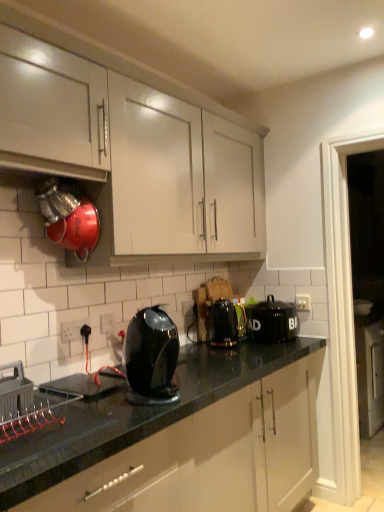
How much space does white plastic electric outlet at lower left, which ranks as the third electric outlet in right-to-left order, occupy vertically?

white plastic electric outlet at lower left, which ranks as the third electric outlet in right-to-left order, is 3.34 inches in height.

Find the location of a particular element. white matte cabinet at upper left is located at coordinates (133, 156).

How much space does black metallic kettle at center, arranged as the second kitchen appliance when viewed from the right, occupy horizontally?

black metallic kettle at center, arranged as the second kitchen appliance when viewed from the right, is 5.95 inches in width.

This screenshot has height=512, width=384. What do you see at coordinates (187, 308) in the screenshot?
I see `white plastic electric outlet at center, the 3th electric outlet from the front` at bounding box center [187, 308].

Find the location of a particular element. The width and height of the screenshot is (384, 512). black matte bread bin at center, placed as the 3th kitchen appliance when sorted from left to right is located at coordinates point(272,321).

Does metallic gray crate at lower left lie in front of white matte cabinet at upper left?

Yes, metallic gray crate at lower left is closer to the viewer.

What are the coordinates of `cabinetry on the right side of metallic gray crate at lower left` in the screenshot? It's located at (133, 156).

Is metallic gray crate at lower left not inside white matte cabinet at upper left?

Yes.

From a real-world perspective, between white matte cabinet at upper left and black metallic kettle at center, the 2th kitchen appliance in the left-to-right sequence, who is vertically lower?

black metallic kettle at center, the 2th kitchen appliance in the left-to-right sequence.

Is white matte cabinet at upper left bigger or smaller than black metallic kettle at center, positioned as the second kitchen appliance in back-to-front order?

In the image, white matte cabinet at upper left appears to be larger than black metallic kettle at center, positioned as the second kitchen appliance in back-to-front order.

Is black metallic kettle at center, the 2th kitchen appliance positioned from the front, a part of white matte cabinet at upper left?

Actually, black metallic kettle at center, the 2th kitchen appliance positioned from the front, is outside white matte cabinet at upper left.

What's the angular difference between white matte cabinet at upper left and black metallic kettle at center, positioned as the second kitchen appliance in back-to-front order,'s facing directions?

5.02 degrees separate the facing orientations of white matte cabinet at upper left and black metallic kettle at center, positioned as the second kitchen appliance in back-to-front order.

From a real-world perspective, is black glossy kettle at center, acting as the 1th kitchen appliance starting from the left, beneath white matte cabinet at upper left?

Yes, from a real-world perspective, black glossy kettle at center, acting as the 1th kitchen appliance starting from the left, is under white matte cabinet at upper left.

From the image's perspective, which is above, black glossy kettle at center, which ranks as the third kitchen appliance in right-to-left order, or white matte cabinet at upper left?

From the image's view, white matte cabinet at upper left is above.

Looking at their sizes, would you say black glossy kettle at center, which is the third kitchen appliance in back-to-front order, is wider or thinner than white matte cabinet at upper left?

In the image, black glossy kettle at center, which is the third kitchen appliance in back-to-front order, appears to be more narrow than white matte cabinet at upper left.

Considering the points (158, 307) and (16, 138), which point is behind, point (158, 307) or point (16, 138)?

The point (158, 307) is behind.

Which object is positioned more to the right, metallic gray crate at lower left or white plastic electric outlet at lower left, the 1th electric outlet viewed from the front?

Positioned to the right is white plastic electric outlet at lower left, the 1th electric outlet viewed from the front.

Is metallic gray crate at lower left far away from white plastic electric outlet at lower left, the 1th electric outlet viewed from the front?

metallic gray crate at lower left is near white plastic electric outlet at lower left, the 1th electric outlet viewed from the front, not far away.

Would you say black metallic kettle at center, the 2th kitchen appliance in the left-to-right sequence, is to the left or to the right of white plastic electric outlet at center, the 3th electric outlet from the front, in the picture?

Based on their positions, black metallic kettle at center, the 2th kitchen appliance in the left-to-right sequence, is located to the right of white plastic electric outlet at center, the 3th electric outlet from the front.

Can we say black metallic kettle at center, the 2th kitchen appliance positioned from the front, lies outside white plastic electric outlet at center, the first electric outlet viewed from the back?

black metallic kettle at center, the 2th kitchen appliance positioned from the front, is positioned outside white plastic electric outlet at center, the first electric outlet viewed from the back.

Looking at the image, does black metallic kettle at center, arranged as the second kitchen appliance when viewed from the right, seem bigger or smaller compared to white plastic electric outlet at center, the 3th electric outlet positioned from the left?

Clearly, black metallic kettle at center, arranged as the second kitchen appliance when viewed from the right, is larger in size than white plastic electric outlet at center, the 3th electric outlet positioned from the left.

From a real-world perspective, is black metallic kettle at center, arranged as the second kitchen appliance when viewed from the right, under white plastic electric outlet at center, the 3th electric outlet from the front?

Yes.

Is metallic gray crate at lower left inside or outside of black matte bread bin at center, placed as the 3th kitchen appliance when sorted from left to right?

metallic gray crate at lower left is located beyond the bounds of black matte bread bin at center, placed as the 3th kitchen appliance when sorted from left to right.

Is metallic gray crate at lower left not close to black matte bread bin at center, which ranks as the first kitchen appliance in right-to-left order?

Yes, metallic gray crate at lower left and black matte bread bin at center, which ranks as the first kitchen appliance in right-to-left order, are quite far apart.

How much distance is there between metallic gray crate at lower left and black matte bread bin at center, which is the first kitchen appliance in back-to-front order?

They are 1.33 meters apart.

Does metallic gray crate at lower left have a larger size compared to black matte bread bin at center, which is the first kitchen appliance in back-to-front order?

Actually, metallic gray crate at lower left might be smaller than black matte bread bin at center, which is the first kitchen appliance in back-to-front order.

From the picture: Which object is wider, metallic gray crate at lower left or white plastic electric outlet at center, the first electric outlet viewed from the back?

metallic gray crate at lower left is wider.

Is metallic gray crate at lower left oriented towards white plastic electric outlet at center, placed as the 1th electric outlet when sorted from right to left?

No.

Is metallic gray crate at lower left to the right of white plastic electric outlet at center, the first electric outlet viewed from the back, from the viewer's perspective?

In fact, metallic gray crate at lower left is to the left of white plastic electric outlet at center, the first electric outlet viewed from the back.

What are the coordinates of `cabinetry on the right of metallic gray crate at lower left` in the screenshot? It's located at (133, 156).

This screenshot has width=384, height=512. Find the location of `cabinetry that is in front of the black metallic kettle at center, positioned as the second kitchen appliance in back-to-front order`. cabinetry that is in front of the black metallic kettle at center, positioned as the second kitchen appliance in back-to-front order is located at coordinates (133, 156).

From the image, which object appears to be farther from white plastic electric outlet at center, the first electric outlet viewed from the back, black matte bread bin at center, the third kitchen appliance viewed from the front, or white plastic electric outlet at lower center, positioned as the second electric outlet in back-to-front order?

white plastic electric outlet at lower center, positioned as the second electric outlet in back-to-front order, is further to white plastic electric outlet at center, the first electric outlet viewed from the back.

Considering their positions, is black matte bread bin at center, which ranks as the first kitchen appliance in right-to-left order, positioned closer to black metallic kettle at center, the 2th kitchen appliance in the left-to-right sequence, than white plastic electric outlet at center, the 3th electric outlet from the front?

black matte bread bin at center, which ranks as the first kitchen appliance in right-to-left order, is positioned closer to the anchor black metallic kettle at center, the 2th kitchen appliance in the left-to-right sequence.

When comparing their distances from black metallic kettle at center, arranged as the second kitchen appliance when viewed from the right, does white plastic electric outlet at lower center, which is the second electric outlet in front-to-back order, or black matte bread bin at center, placed as the 3th kitchen appliance when sorted from left to right, seem further?

white plastic electric outlet at lower center, which is the second electric outlet in front-to-back order, is positioned further to the anchor black metallic kettle at center, arranged as the second kitchen appliance when viewed from the right.

Looking at the image, which one is located closer to metallic gray crate at lower left, black glossy kettle at center, which ranks as the third kitchen appliance in right-to-left order, or white plastic electric outlet at lower left, the 1th electric outlet viewed from the front?

white plastic electric outlet at lower left, the 1th electric outlet viewed from the front, is positioned closer to the anchor metallic gray crate at lower left.

Which object lies further to the anchor point white plastic electric outlet at lower center, acting as the 2th electric outlet starting from the left, white matte cabinet at upper left or metallic gray crate at lower left?

white matte cabinet at upper left.

Looking at the image, which one is located further to white plastic electric outlet at center, the 3th electric outlet positioned from the left, metallic gray crate at lower left or black matte bread bin at center, which ranks as the first kitchen appliance in right-to-left order?

metallic gray crate at lower left lies further to white plastic electric outlet at center, the 3th electric outlet positioned from the left, than the other object.

Looking at the image, which one is located further to black matte bread bin at center, which ranks as the first kitchen appliance in right-to-left order, black metallic kettle at center, the 2th kitchen appliance positioned from the front, or white plastic electric outlet at lower left, which is counted as the third electric outlet, starting from the back?

Among the two, white plastic electric outlet at lower left, which is counted as the third electric outlet, starting from the back, is located further to black matte bread bin at center, which ranks as the first kitchen appliance in right-to-left order.

Looking at the image, which one is located closer to white plastic electric outlet at lower center, the second electric outlet in the right-to-left sequence, black matte bread bin at center, which ranks as the first kitchen appliance in right-to-left order, or white plastic electric outlet at lower left, which ranks as the third electric outlet in right-to-left order?

white plastic electric outlet at lower left, which ranks as the third electric outlet in right-to-left order, lies closer to white plastic electric outlet at lower center, the second electric outlet in the right-to-left sequence, than the other object.

Locate an element on the screen. cabinetry between white plastic electric outlet at lower center, positioned as the second electric outlet in back-to-front order, and black matte bread bin at center, the third kitchen appliance viewed from the front is located at coordinates (133, 156).

At what (x,y) coordinates should I click in order to perform the action: click on kitchen appliance between black glossy kettle at center, which is the third kitchen appliance in back-to-front order, and black matte bread bin at center, placed as the 3th kitchen appliance when sorted from left to right, along the z-axis. Please return your answer as a coordinate pair (x, y). This screenshot has height=512, width=384. Looking at the image, I should click on (224, 323).

The height and width of the screenshot is (512, 384). Find the location of `electric outlet located between metallic gray crate at lower left and white plastic electric outlet at lower center, the second electric outlet in the right-to-left sequence, in the depth direction`. electric outlet located between metallic gray crate at lower left and white plastic electric outlet at lower center, the second electric outlet in the right-to-left sequence, in the depth direction is located at coordinates (73, 329).

The width and height of the screenshot is (384, 512). I want to click on cabinetry located between metallic gray crate at lower left and black metallic kettle at center, the 2th kitchen appliance in the left-to-right sequence, in the depth direction, so click(x=133, y=156).